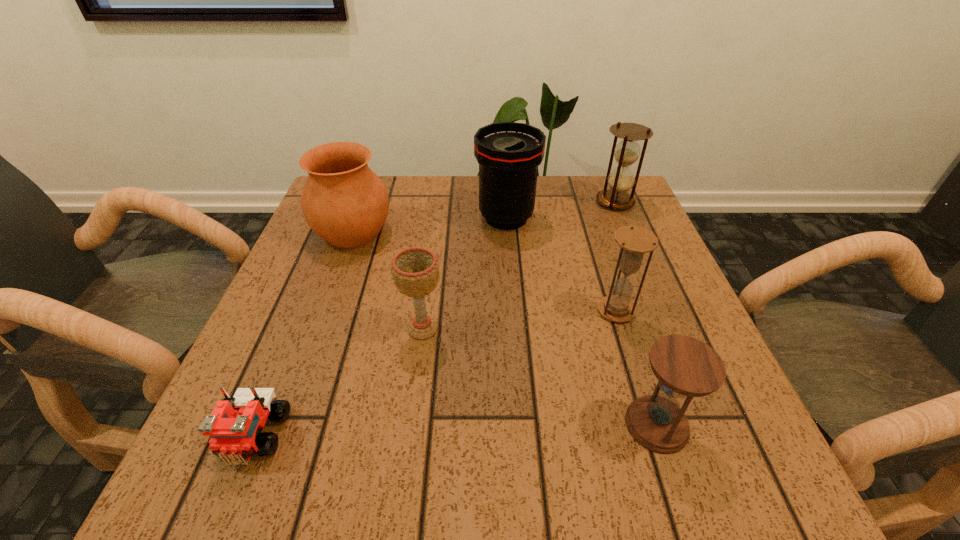
This screenshot has height=540, width=960. I want to click on telephoto lens, so click(x=509, y=153).

You are a GUI agent. You are given a task and a screenshot of the screen. Output one action in this format:
    pyautogui.click(x=<x>, y=<y>)
    Task: Click on the farthest hourglass
    
    Given the screenshot: What is the action you would take?
    pyautogui.click(x=621, y=179)

What are the coordinates of `pottery` in the screenshot? It's located at (343, 201).

Where is `the second farthest hourglass`? the second farthest hourglass is located at coordinates (634, 241).

What are the coordinates of `the third object from left to right` in the screenshot? It's located at (415, 270).

At what (x,y) coordinates should I click in order to perform the action: click on the nearest hourglass. Please return your answer as a coordinate pair (x, y). The image size is (960, 540). Looking at the image, I should click on (686, 367).

Locate an element on the screen. Lego is located at coordinates click(x=235, y=426).

This screenshot has width=960, height=540. Find the location of `free space located on the left of the fourth object from left to right`. free space located on the left of the fourth object from left to right is located at coordinates (393, 218).

Locate an element on the screen. vacant space located on the left of the farthest hourglass is located at coordinates (577, 202).

Locate an element on the screen. vacant space located 0.050m on the front of the pottery is located at coordinates (338, 272).